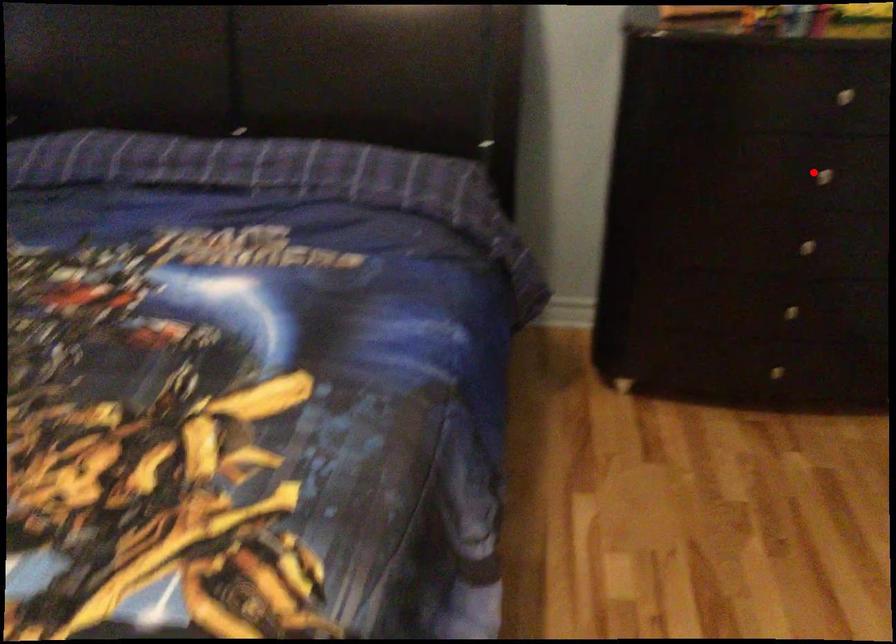
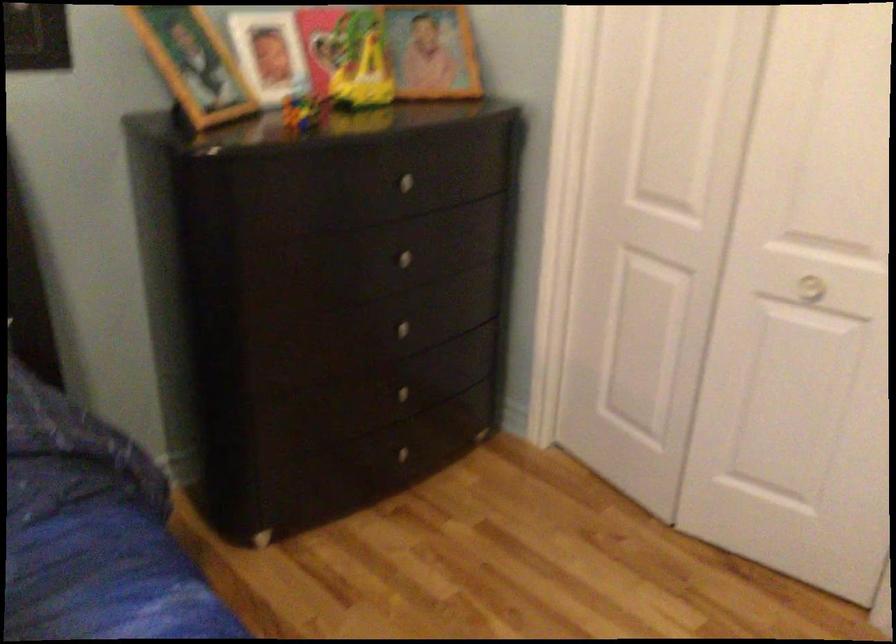
In the second image, find the point that corresponds to the highlighted location in the first image.

(399, 258)